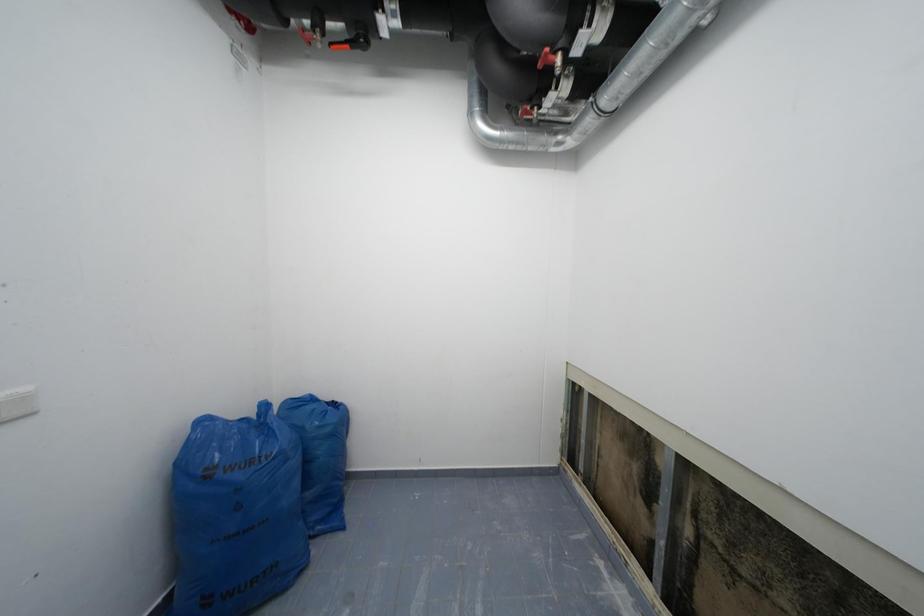
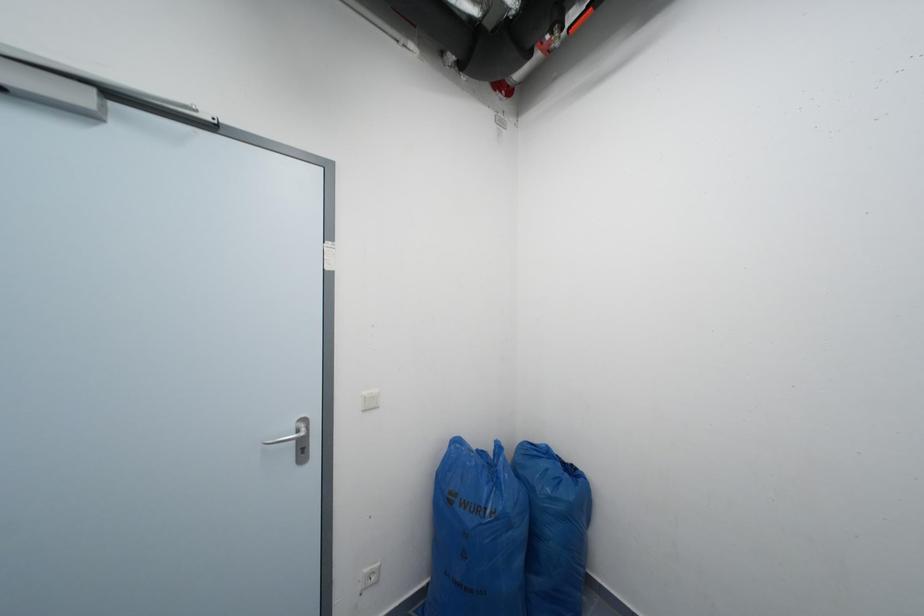
Question: The images are taken continuously from a first-person perspective. In which direction is your viewpoint rotating?

Choices:
 (A) Left
 (B) Right
 (C) Up
 (D) Down

Answer: (A)